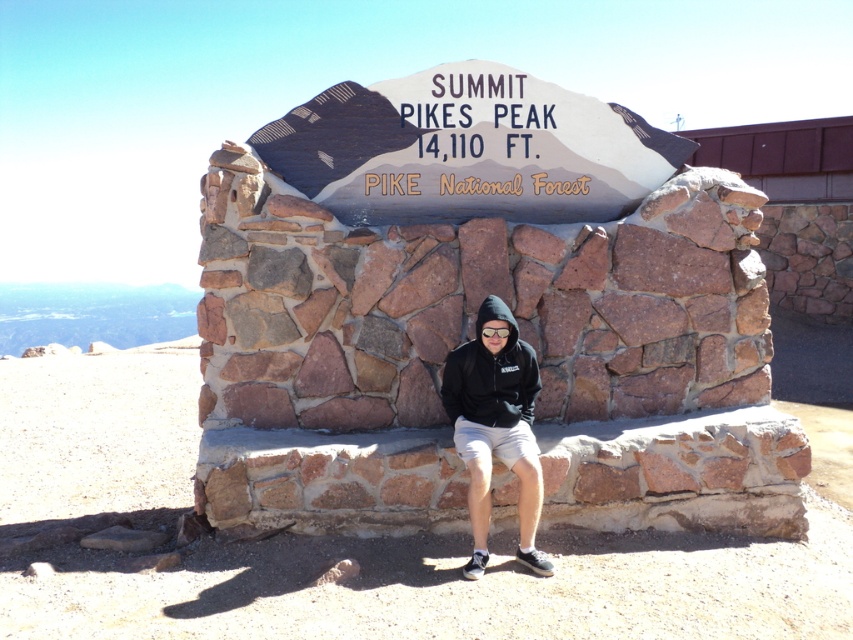
Is black hoodie at center above black fleece sweatshirt at center?

No.

Does black hoodie at center appear on the left side of black fleece sweatshirt at center?

Incorrect, black hoodie at center is not on the left side of black fleece sweatshirt at center.

Find the location of `black hoodie at center`. black hoodie at center is located at coordinates (495, 426).